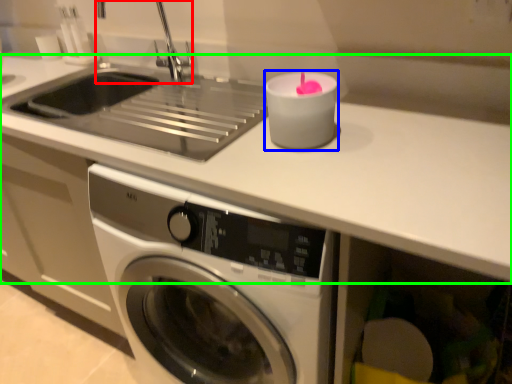
Question: Considering the real-world distances, which object is farthest from faucet (highlighted by a red box)? candle holder (highlighted by a blue box) or counter top (highlighted by a green box)?

Choices:
 (A) candle holder
 (B) counter top

Answer: (B)